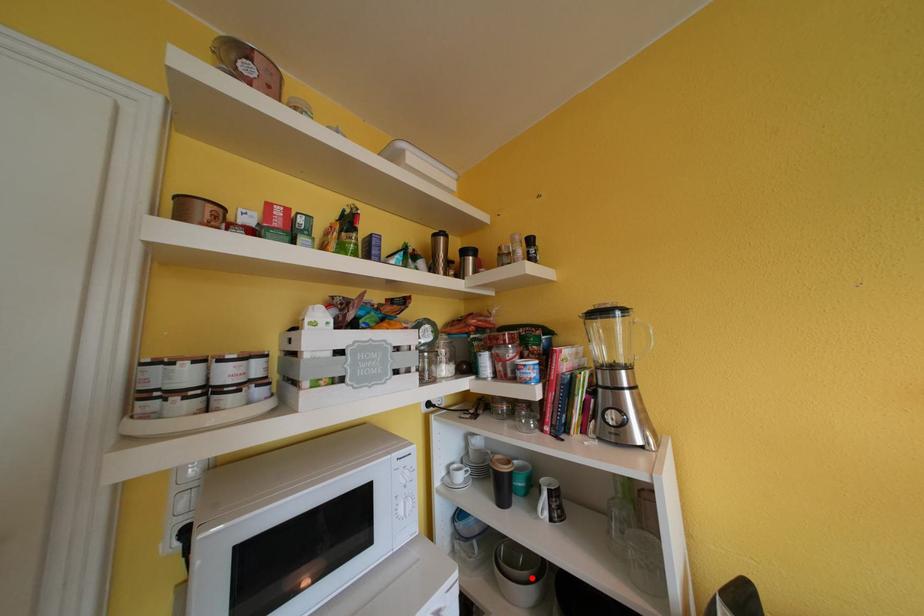
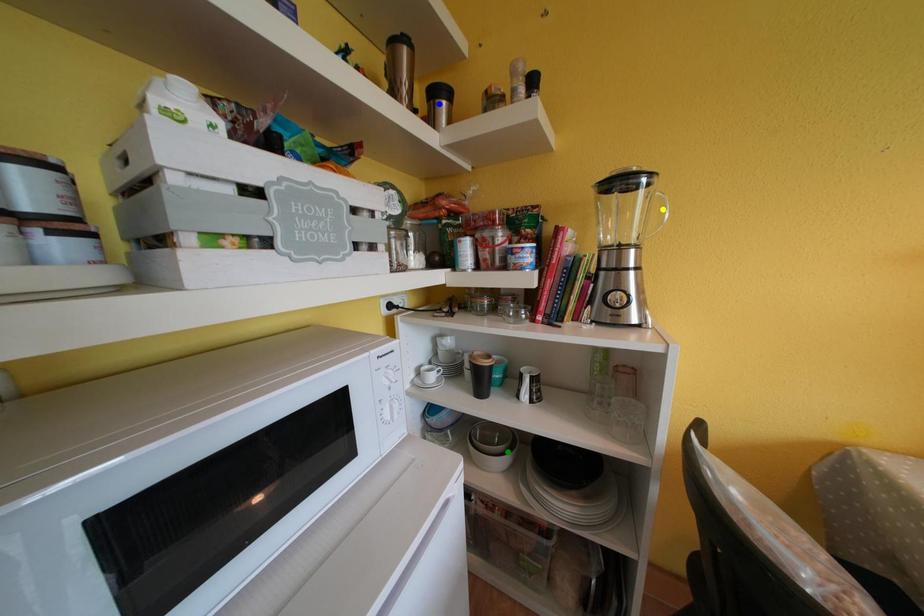
Question: I am providing you with two images of the same scene from different viewpoints. A red point is marked on the first image. You are given multiple points on the second image. Which mark in image 2 goes with the point in image 1?

Choices:
 (A) green point
 (B) blue point
 (C) yellow point

Answer: (A)